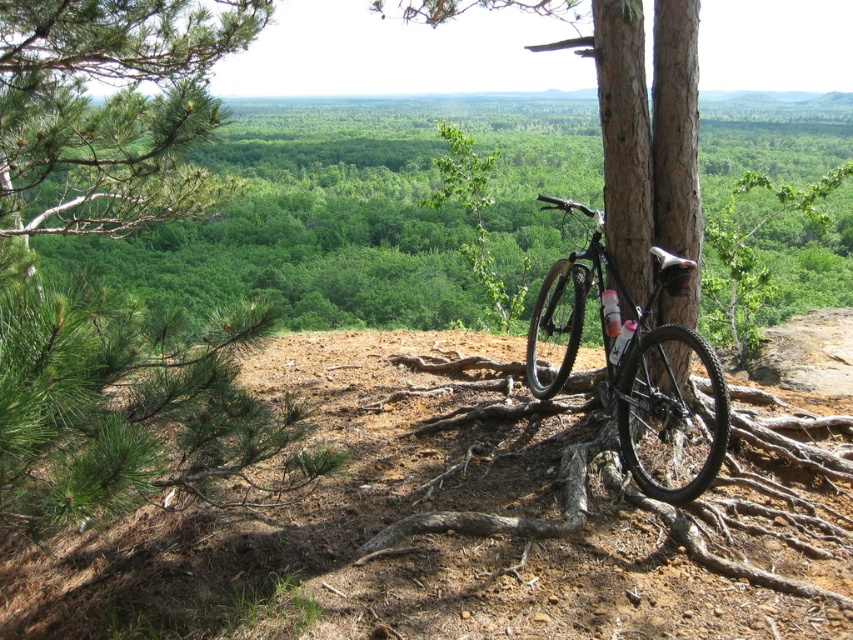
You are planning to place a new bench between the matte black bicycle at center and the brown rough tree roots at center. Based on their widths, which object should the bench be placed closer to to ensure it fits comfortably?

The bench should be placed closer to the brown rough tree roots at center because the matte black bicycle at center might be wider, requiring more space.

You are a hiker who wants to take a photo of the green pine tree at upper left and the brown rough tree roots at center. Which object should you focus on first if you want to capture both in one shot without moving the camera?

You should focus on the brown rough tree roots at center first since the green pine tree at upper left is not as tall as the brown rough tree roots at center, meaning the pine tree is closer to the camera. By focusing on the closer object, you can ensure both are in focus using depth of field.